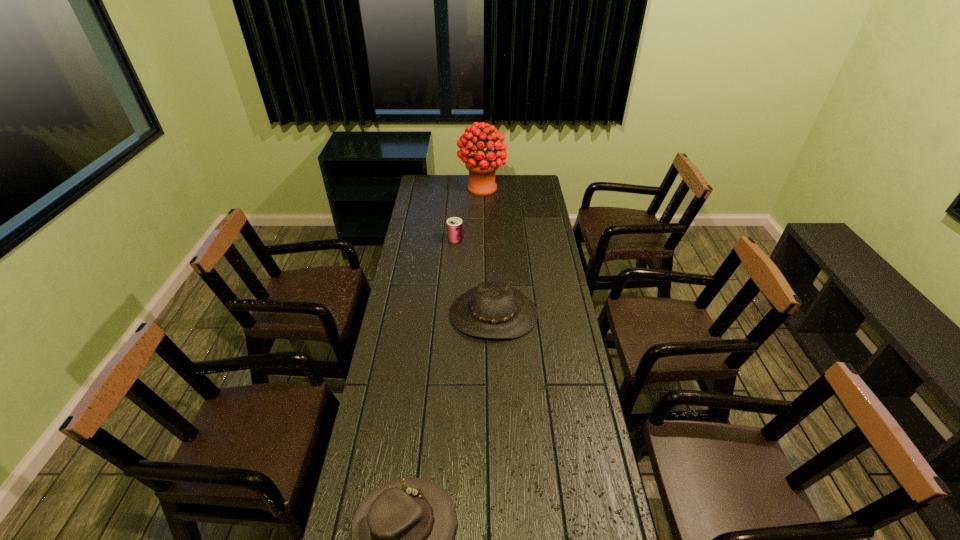
Locate an element on the screen. The width and height of the screenshot is (960, 540). vacant space in between the farthest object and the can is located at coordinates (468, 214).

The width and height of the screenshot is (960, 540). Identify the location of object that is the second closest one to the can. (482, 166).

Identify which object is the closest to the third nearest object. Please provide its 2D coordinates. Your answer should be formatted as a tuple, i.e. [(x, y)], where the tuple contains the x and y coordinates of a point satisfying the conditions above.

[(495, 310)]